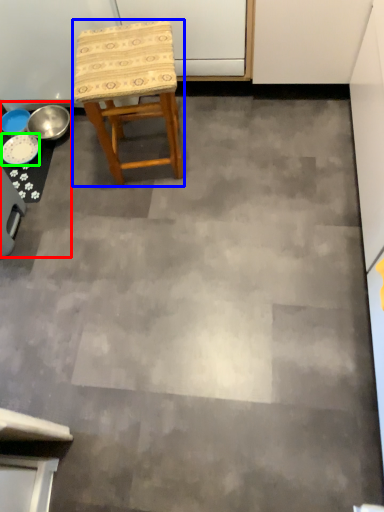
Question: Considering the real-world distances, which object is closest to table (highlighted by a red box)? stool (highlighted by a blue box) or plate (highlighted by a green box).

Choices:
 (A) stool
 (B) plate

Answer: (B)